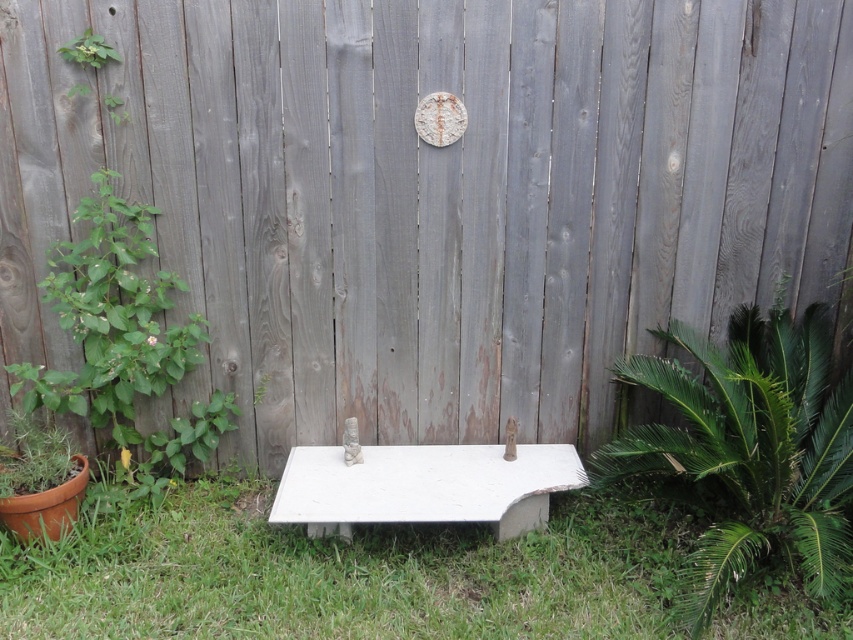
Question: Considering the relative positions of green grass at lower center and green leafy plant at lower right in the image provided, where is green grass at lower center located with respect to green leafy plant at lower right?

Choices:
 (A) above
 (B) below

Answer: (B)

Question: Can you confirm if green grass at lower center is wider than green leafy plant at lower right?

Choices:
 (A) no
 (B) yes

Answer: (B)

Question: Which of the following is the farthest from the observer?

Choices:
 (A) (201, 586)
 (B) (97, 45)

Answer: (B)

Question: Which point is farther to the camera?

Choices:
 (A) (786, 417)
 (B) (418, 611)
 (C) (553, 484)
 (D) (109, 58)

Answer: (C)

Question: Which point is closer to the camera taking this photo?

Choices:
 (A) (630, 596)
 (B) (82, 42)
 (C) (807, 486)
 (D) (293, 506)

Answer: (A)

Question: Is green grass at lower center further to camera compared to white concrete bench at center?

Choices:
 (A) yes
 (B) no

Answer: (B)